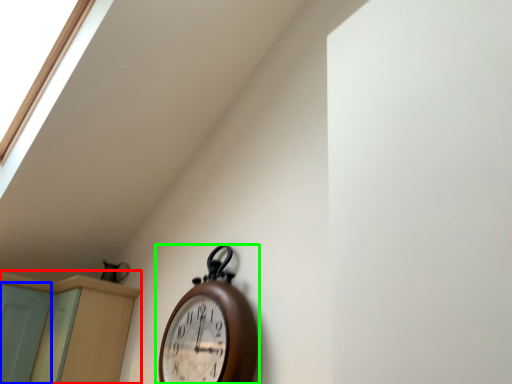
Question: Considering the real-world distances, which object is farthest from dresser (highlighted by a red box)? screen door (highlighted by a blue box) or wall clock (highlighted by a green box)?

Choices:
 (A) screen door
 (B) wall clock

Answer: (B)